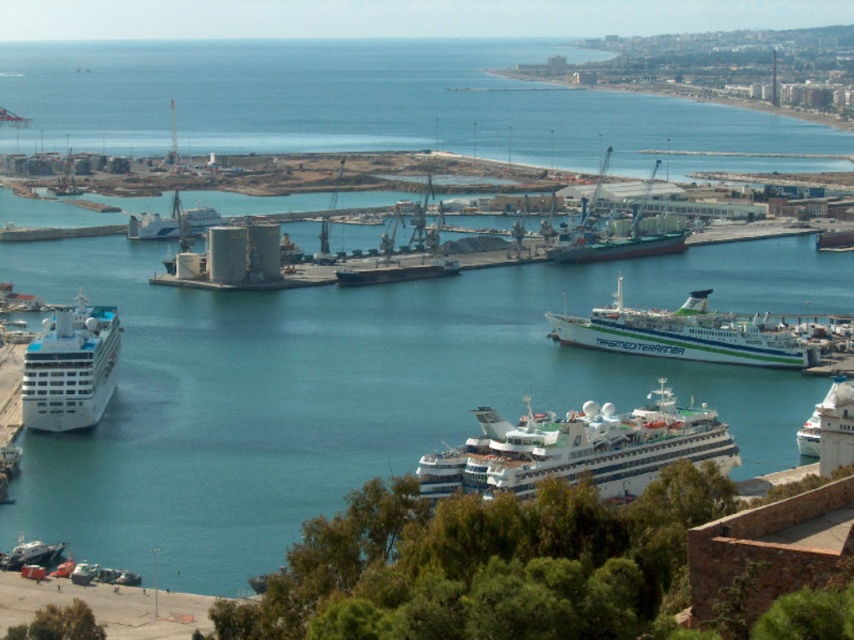
Question: Which point is farther from the camera taking this photo?

Choices:
 (A) (817, 428)
 (B) (319, 445)
 (C) (809, 355)

Answer: (C)

Question: Considering the real-world distances, which object is closest to the metallic gray boat at lower left?

Choices:
 (A) clear blue water at center
 (B) white glossy ferry at center
 (C) white glossy cruise ship at center-right

Answer: (A)

Question: Can you confirm if clear blue water at center is smaller than white glossy cruise ship at lower left?

Choices:
 (A) yes
 (B) no

Answer: (B)

Question: Considering the real-world distances, which object is closest to the white glossy cruise ship at center?

Choices:
 (A) white glossy cruise ship at lower right
 (B) white glossy cruise ship at center-right

Answer: (B)

Question: From the image, what is the correct spatial relationship of white glossy cruise ship at center in relation to metallic gray boat at lower left?

Choices:
 (A) above
 (B) below

Answer: (A)

Question: Is white glossy cruise ship at lower left smaller than metallic gray boat at lower left?

Choices:
 (A) yes
 (B) no

Answer: (B)